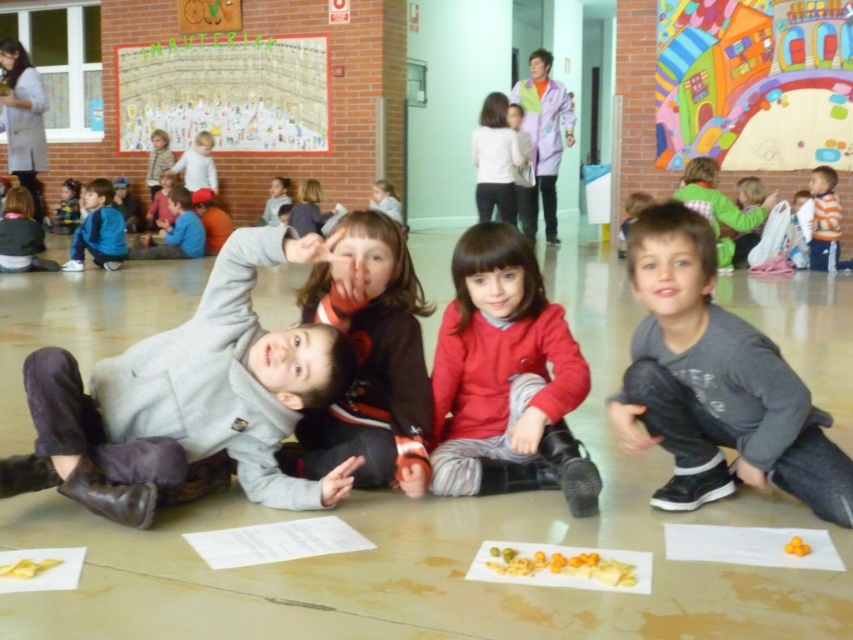
Question: Is white paper collage at upper left thinner than matte gray hoodie at upper right?

Choices:
 (A) yes
 (B) no

Answer: (B)

Question: Does colorful paper collage at upper right have a greater width compared to white cotton sweater at center?

Choices:
 (A) yes
 (B) no

Answer: (A)

Question: Estimate the real-world distances between objects in this image. Which object is closer to the colorful paper collage at upper right?

Choices:
 (A) white paper collage at upper left
 (B) white cotton sweater at center
 (C) orange striped shirt at right
 (D) smooth beige sweater at center

Answer: (C)

Question: Can you confirm if blue fleece jacket at left is thinner than yellow matte snack at center?

Choices:
 (A) yes
 (B) no

Answer: (B)

Question: Which object is positioned closest to the matte gray hoodie at upper right?

Choices:
 (A) gray wool sweater at center
 (B) red cotton shirt at center
 (C) white paper collage at upper left

Answer: (B)

Question: Which point is farther to the camera?

Choices:
 (A) (85, 189)
 (B) (822, 248)
 (C) (422, 483)

Answer: (A)